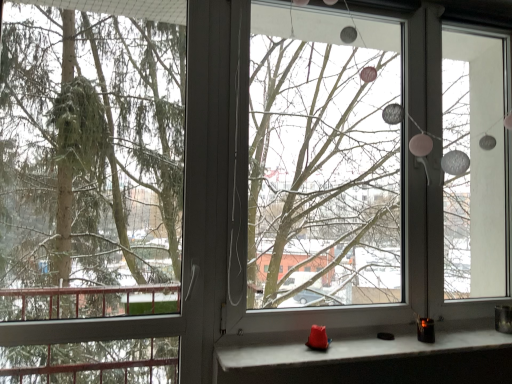
Question: Do you think transparent glass window screen at center is within green matte tree at left, or outside of it?

Choices:
 (A) outside
 (B) inside

Answer: (A)

Question: Looking at the image, does transparent glass window screen at center seem bigger or smaller compared to green matte tree at left?

Choices:
 (A) small
 (B) big

Answer: (B)

Question: Which is farther from the transparent glass window screen at center?

Choices:
 (A) matte white stone at lower center
 (B) green matte tree at left

Answer: (A)

Question: Considering the real-world distances, which object is closest to the transparent glass window screen at center?

Choices:
 (A) green matte tree at left
 (B) matte white stone at lower center

Answer: (A)